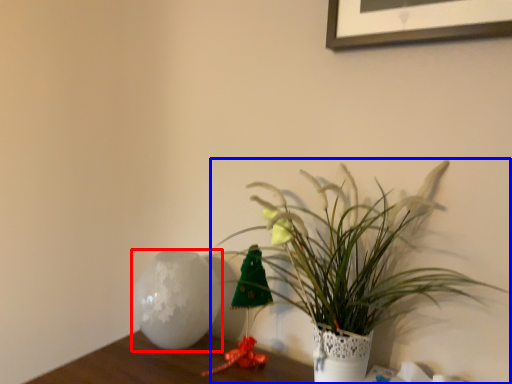
Question: Among these objects, which one is nearest to the camera, vase (highlighted by a red box) or houseplant (highlighted by a blue box)?

Choices:
 (A) vase
 (B) houseplant

Answer: (B)